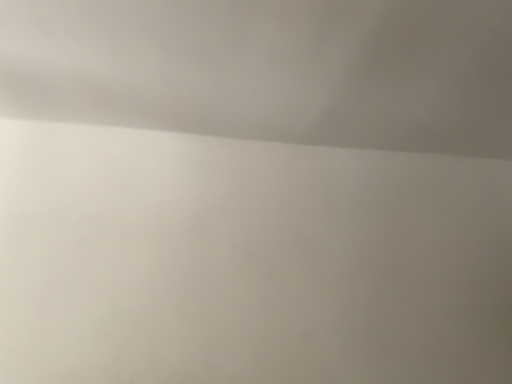
Find the location of a particular element. The height and width of the screenshot is (384, 512). white matte cloud at upper center is located at coordinates (270, 69).

The width and height of the screenshot is (512, 384). Describe the element at coordinates (270, 69) in the screenshot. I see `white matte cloud at upper center` at that location.

The height and width of the screenshot is (384, 512). I want to click on white matte cloud at upper center, so click(x=270, y=69).